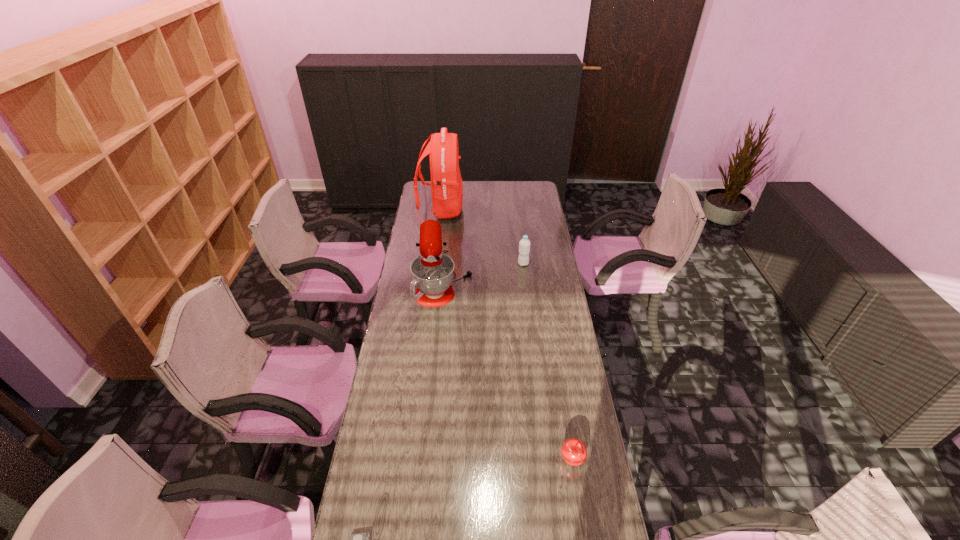
In the image, there is a desktop. In order to click on blank space at the far right corner in this screenshot , I will do `click(517, 181)`.

Locate an element on the screen. vacant area that lies between the third tallest object and the second tallest object is located at coordinates (484, 272).

The image size is (960, 540). What are the coordinates of `free space between the water bottle and the tallest object` in the screenshot? It's located at [482, 238].

At what (x,y) coordinates should I click in order to perform the action: click on free point between the mixer and the cherry. Please return your answer as a coordinate pair (x, y). This screenshot has height=540, width=960. Looking at the image, I should click on (509, 370).

Identify the location of vacant area between the rightmost object and the mixer. This screenshot has height=540, width=960. (509, 370).

This screenshot has height=540, width=960. I want to click on unoccupied area between the second tallest object and the tallest object, so tap(443, 245).

Identify the location of object identified as the closest to the fourth shortest object. (446, 184).

At what (x,y) coordinates should I click in order to perform the action: click on object that stands as the closest to the third shortest object. Please return your answer as a coordinate pair (x, y). The width and height of the screenshot is (960, 540). Looking at the image, I should click on (432, 271).

This screenshot has width=960, height=540. What are the coordinates of `free space that satisfies the following two spatial constraints: 1. on the bowl side of the cherry; 2. on the right side of the mixer` in the screenshot? It's located at (427, 461).

Where is `free space that satisfies the following two spatial constraints: 1. on the front side of the water bottle; 2. on the bowl side of the mixer`? The width and height of the screenshot is (960, 540). free space that satisfies the following two spatial constraints: 1. on the front side of the water bottle; 2. on the bowl side of the mixer is located at coordinates (525, 279).